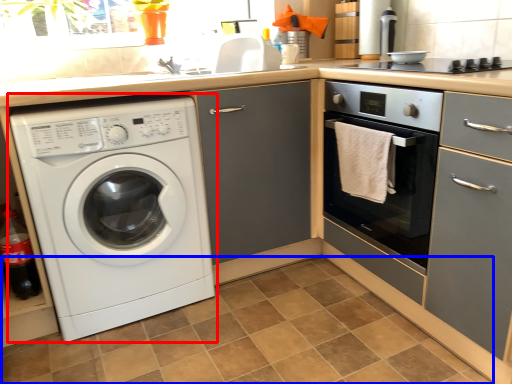
Question: Which of the following is the closest to the observer, washing machine (highlighted by a red box) or tile (highlighted by a blue box)?

Choices:
 (A) washing machine
 (B) tile

Answer: (B)